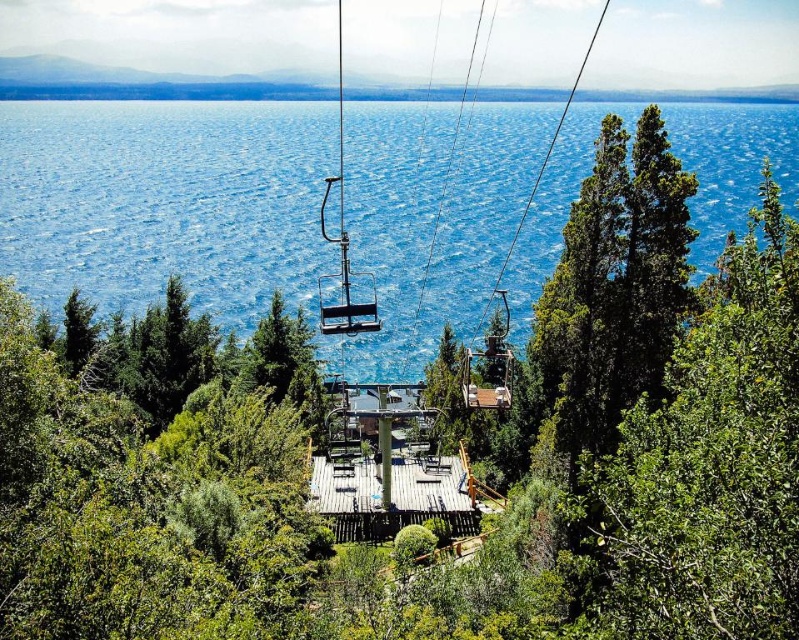
You are planning to install a new lighting system on the metallic silver ski lift at center. To avoid blocking the view of the green leafy tree at right from the ski lift, should the lights be placed above or below the ski lift structure?

The green leafy tree at right is positioned under the metallic silver ski lift at center. Therefore, placing the lights above the ski lift structure would avoid blocking the view of the tree from the lift.

You are standing at the camera position and want to throw a stone into the blue water at center. Is the distance within your throwing range if your maximum throwing distance is 40 meters?

The blue water at center and camera are 39.48 meters apart, so yes, the distance is within your throwing range since it is less than 40 meters.